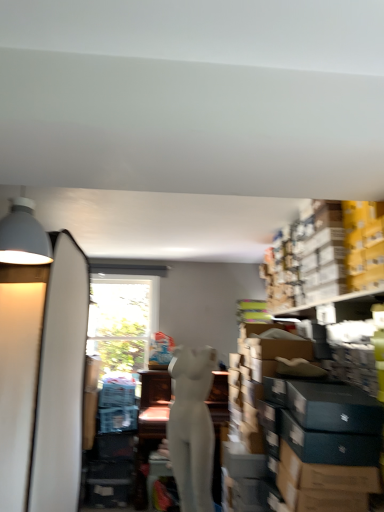
Question: From the image's perspective, is yellow cardboard boxes at upper right located above or below matte gray lampshade at upper left?

Choices:
 (A) above
 (B) below

Answer: (B)

Question: From a real-world perspective, relative to matte gray lampshade at upper left, is yellow cardboard boxes at upper right vertically above or below?

Choices:
 (A) above
 (B) below

Answer: (B)

Question: Which object is positioned closest to the matte gray lampshade at upper left?

Choices:
 (A) white matte mannequin at center
 (B) yellow cardboard boxes at upper right
 (C) white matte surfboard at left

Answer: (C)

Question: Considering the real-world distances, which object is closest to the matte gray lampshade at upper left?

Choices:
 (A) white matte mannequin at center
 (B) yellow cardboard boxes at upper right
 (C) white matte surfboard at left

Answer: (C)